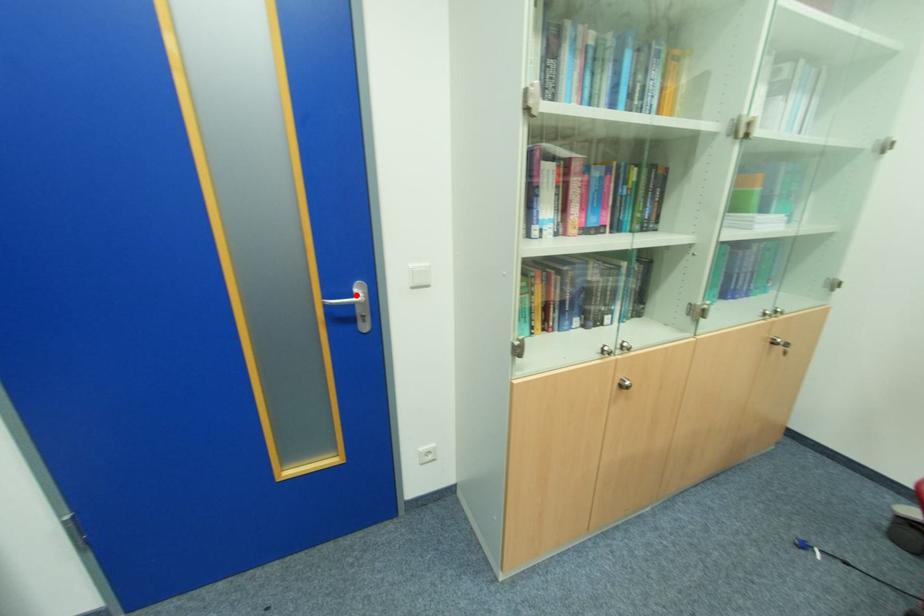
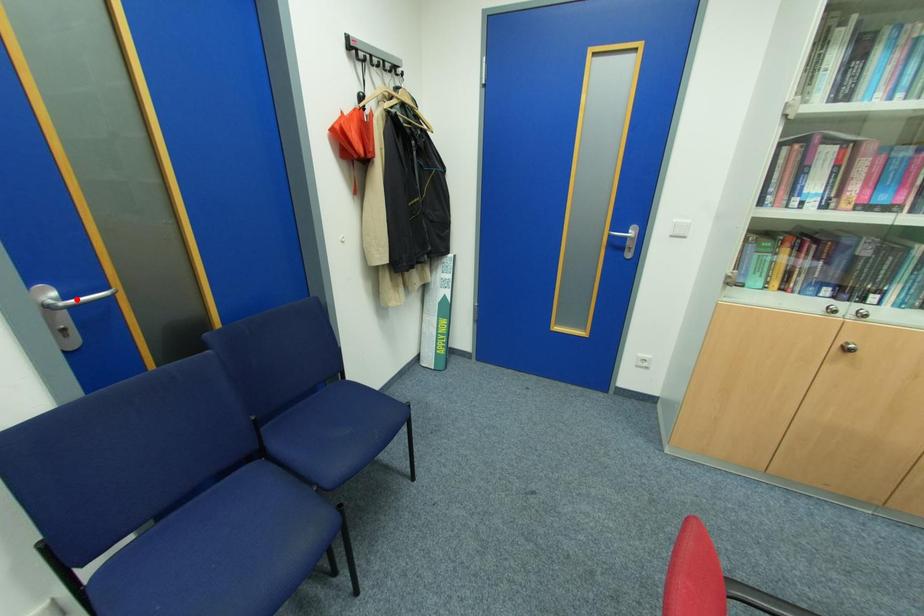
I am providing you with two images of the same scene from different viewpoints. A red point is marked on the first image and another point is marked on the second image. Is the marked point in image1 the same physical position as the marked point in image2?

No